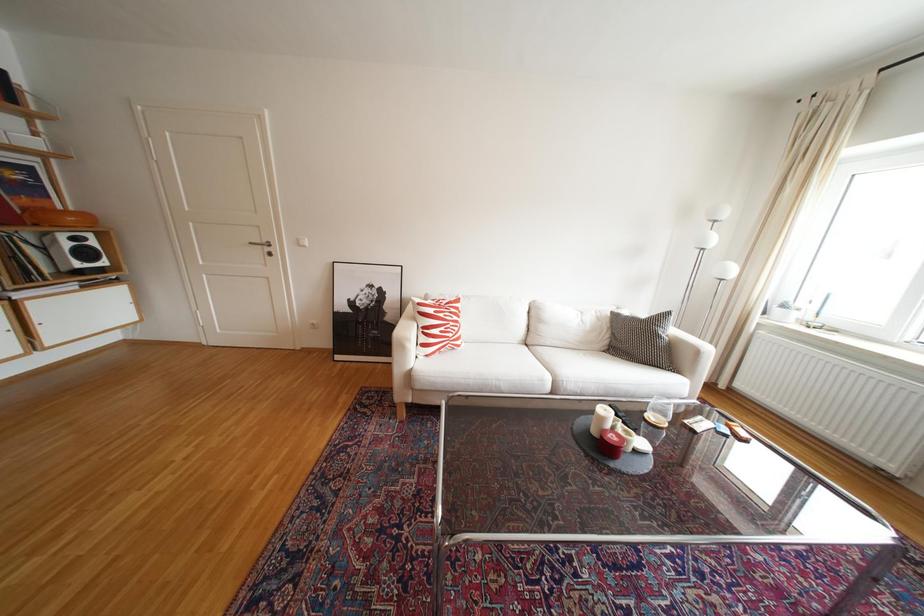
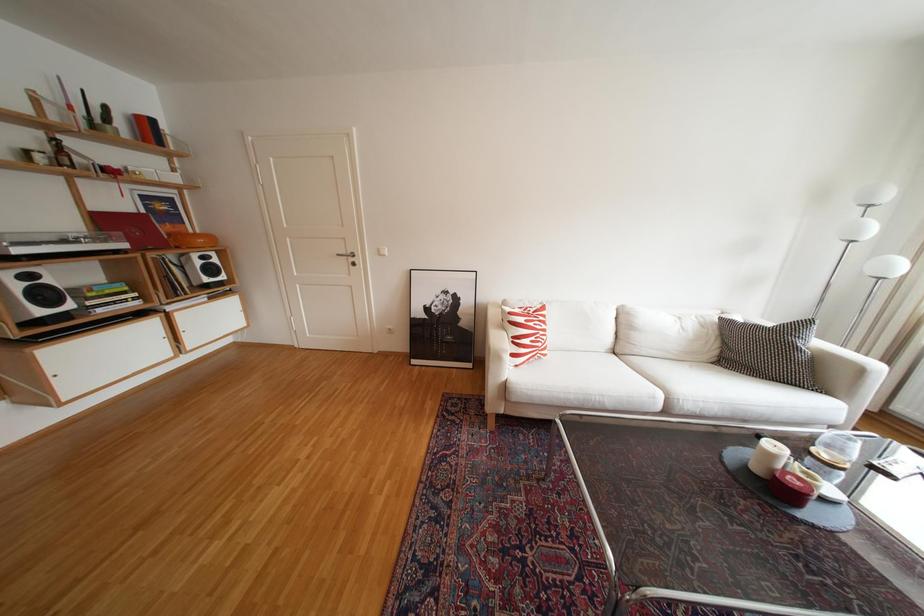
Question: Which direction would the cameraman need to move to produce the second image? Reply with the corresponding letter.

Choices:
 (A) Left
 (B) Right
 (C) Forward
 (D) Backward

Answer: (A)